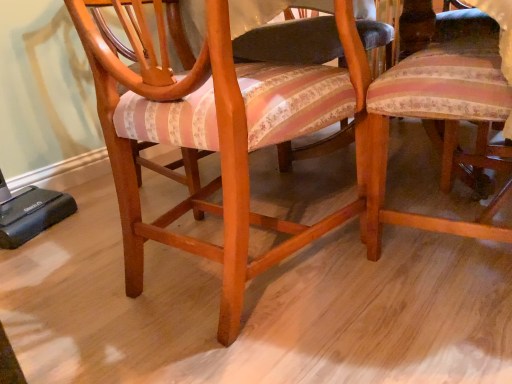
Measure the distance between point (227, 100) and camera.

A distance of 27.72 inches exists between point (227, 100) and camera.

What do you see at coordinates (219, 136) in the screenshot?
I see `wooden chair at center` at bounding box center [219, 136].

This screenshot has width=512, height=384. Find the location of `wooden chair at center`. wooden chair at center is located at coordinates (219, 136).

What is the approximate height of wooden chair at center?

It is 27.19 inches.

At what (x,y) coordinates should I click in order to perform the action: click on wooden chair at center. Please return your answer as a coordinate pair (x, y). This screenshot has height=384, width=512. Looking at the image, I should click on (219, 136).